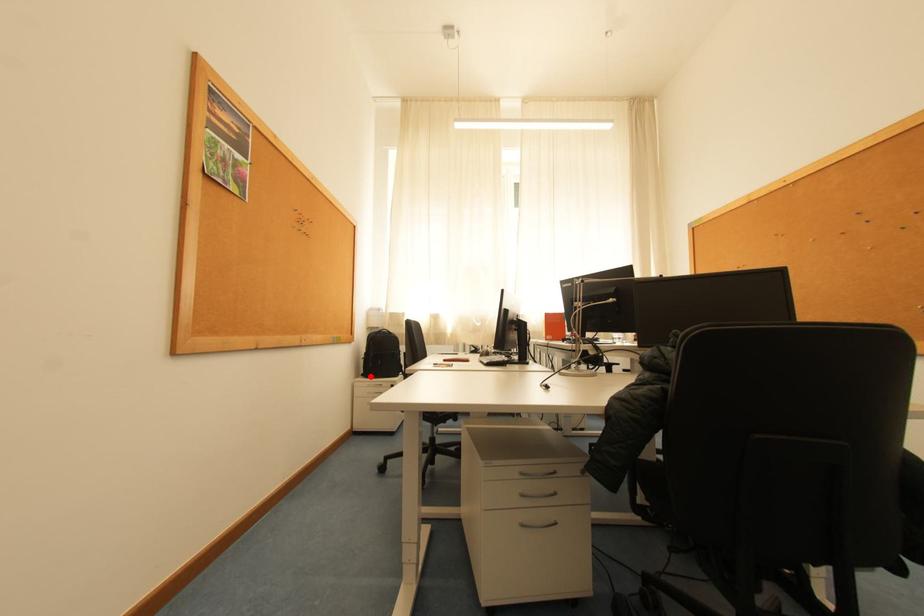
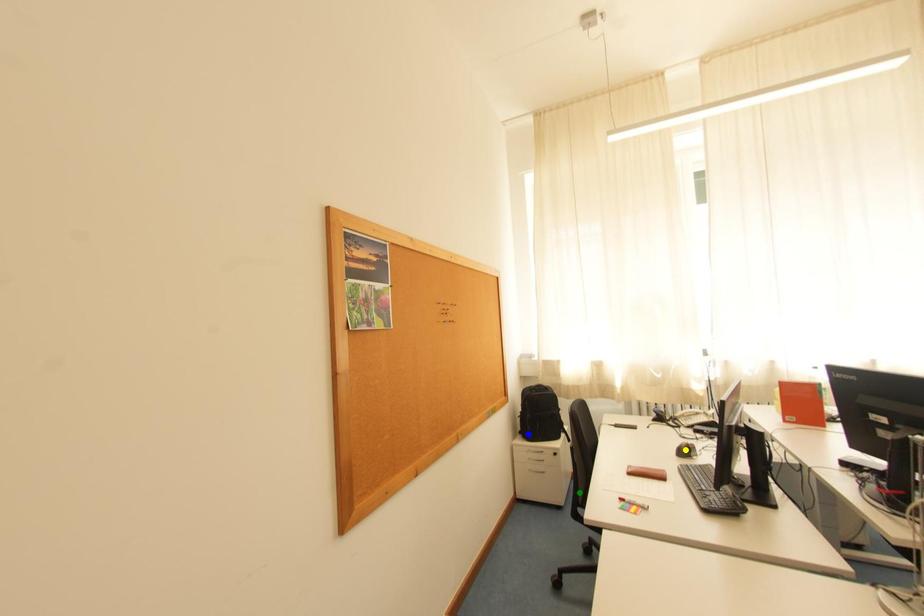
Question: I am providing you with two images of the same scene from different viewpoints. A red point is marked on the first image. You are given multiple points on the second image. Which point in image 2 represents the same 3d spot as the red point in image 1?

Choices:
 (A) blue point
 (B) green point
 (C) yellow point

Answer: (A)